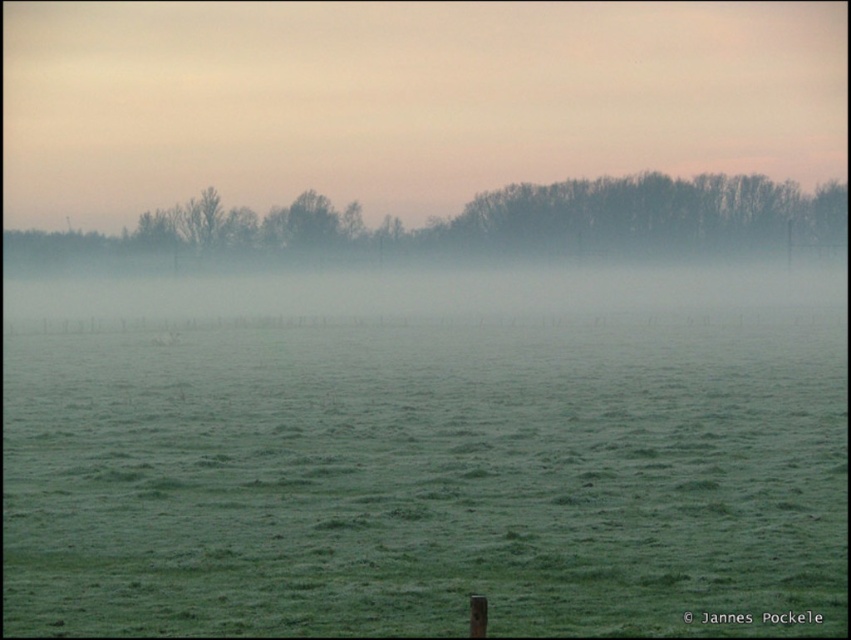
Question: Is green grass at center further to camera compared to silhouette bare trees at upper center?

Choices:
 (A) no
 (B) yes

Answer: (A)

Question: Can you confirm if green grass at center is positioned below silhouette bare trees at upper center?

Choices:
 (A) yes
 (B) no

Answer: (A)

Question: Considering the relative positions of green grass at center and silhouette bare trees at upper center in the image provided, where is green grass at center located with respect to silhouette bare trees at upper center?

Choices:
 (A) below
 (B) above

Answer: (A)

Question: Which of the following is the farthest from the observer?

Choices:
 (A) silhouette bare trees at upper center
 (B) green grass at center

Answer: (A)